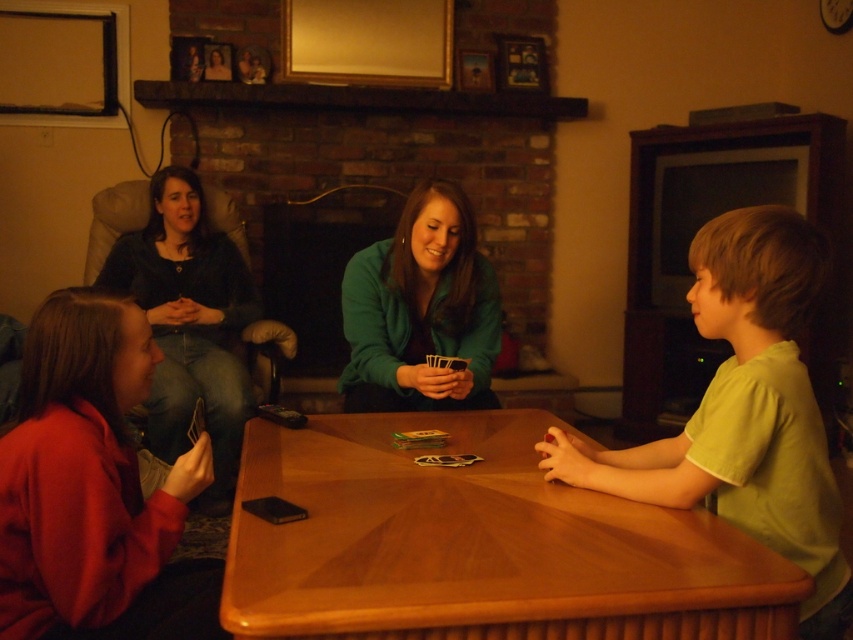
Question: Which of these objects is positioned farthest from the matte red sweater at lower left?

Choices:
 (A) matte black shirt at left
 (B) brick fireplace at center
 (C) green cotton shirt at right

Answer: (B)

Question: Which is farther from the shiny plastic cards at center?

Choices:
 (A) green cotton shirt at right
 (B) brick fireplace at center

Answer: (B)

Question: Estimate the real-world distances between objects in this image. Which object is farther from the brick fireplace at center?

Choices:
 (A) wooden table at center
 (B) matte red sweater at lower left

Answer: (B)

Question: Where is green cotton shirt at right located in relation to matte black shirt at left in the image?

Choices:
 (A) right
 (B) left

Answer: (A)

Question: Is matte red sweater at lower left thinner than brick fireplace at center?

Choices:
 (A) no
 (B) yes

Answer: (B)

Question: Is wooden table at center below matte black shirt at left?

Choices:
 (A) yes
 (B) no

Answer: (A)